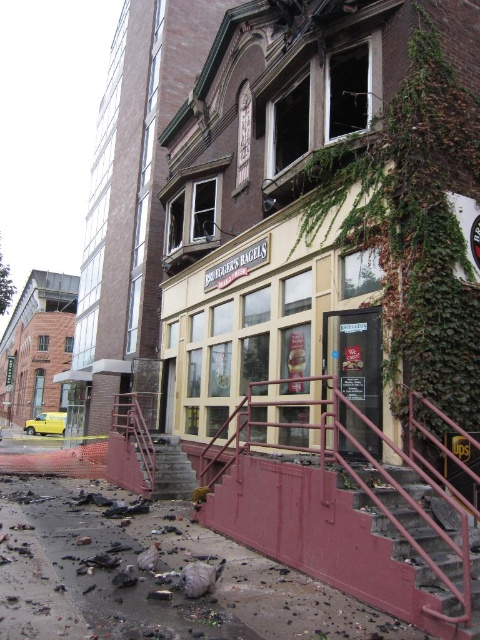
You are a city planner reviewing the damaged storefront. The green ivy at upper right is part of the building facade. Based on its location, can you determine if it is positioned closer to the top or bottom of the building?

The green ivy at upper right is located at point (414, 227), which places it closer to the top of the building since the y coordinate 0.863 is closer to 1.0 than 0.0 in the coordinate system.

You are a firefighter assessing the damage to the building. You need to access the upper floors to check for any remaining hazards. The green ivy at upper right and the rusty metal stairs at lower right are visible from your current position. Which object should you approach first to reach the upper floors safely?

You should approach the rusty metal stairs at lower right first because the green ivy at upper right is located to the right of them, meaning the stairs are closer and more accessible for reaching the upper floors.